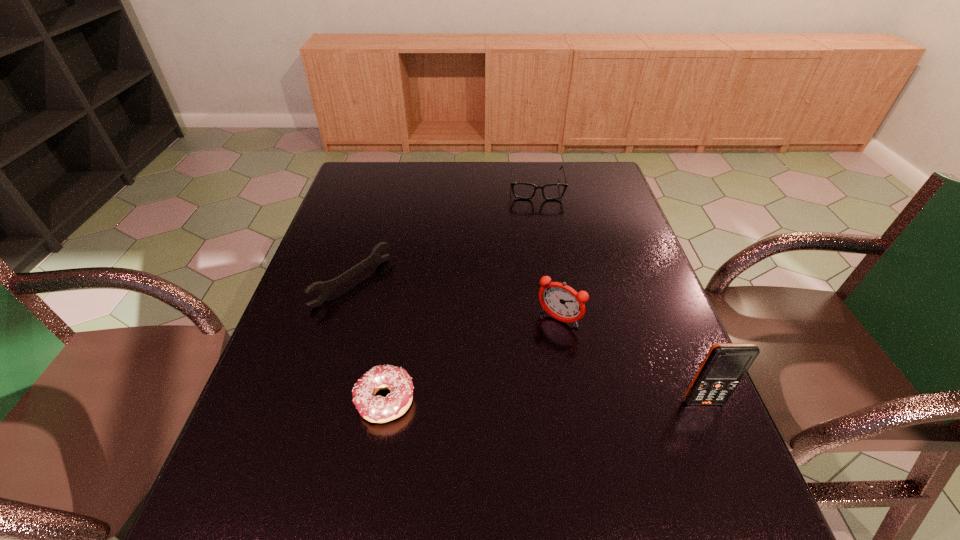
Locate an element on the screen. This screenshot has height=540, width=960. free spot at the far edge of the desktop is located at coordinates (449, 183).

In the image, there is a desktop. What are the coordinates of `blank space at the left edge` in the screenshot? It's located at (297, 361).

The image size is (960, 540). I want to click on free location at the right edge of the desktop, so click(x=624, y=396).

Locate an element on the screen. vacant area at the near left corner of the desktop is located at coordinates point(269,448).

Find the location of `free space between the wrench and the doughnut`. free space between the wrench and the doughnut is located at coordinates (369, 341).

Locate an element on the screen. free space between the rightmost object and the farthest object is located at coordinates (619, 294).

I want to click on vacant area that lies between the spectacles and the second tallest object, so click(x=547, y=253).

This screenshot has height=540, width=960. Find the location of `vacant space in between the farthest object and the wrench`. vacant space in between the farthest object and the wrench is located at coordinates coord(444,234).

Image resolution: width=960 pixels, height=540 pixels. I want to click on vacant region between the alarm clock and the cellular telephone, so tap(631, 361).

Where is `vacant space in between the wrench and the doughnut`? The width and height of the screenshot is (960, 540). vacant space in between the wrench and the doughnut is located at coordinates (369, 341).